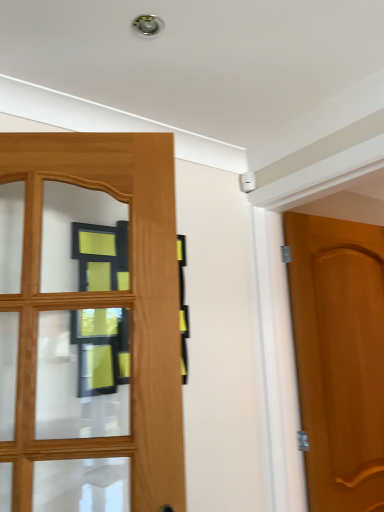
Measure the distance between wooden door at right and camera.

A distance of 5.68 feet exists between wooden door at right and camera.

This screenshot has height=512, width=384. Describe the element at coordinates (339, 357) in the screenshot. I see `wooden door at right` at that location.

Where is `wooden door at right`? The height and width of the screenshot is (512, 384). wooden door at right is located at coordinates (339, 357).

This screenshot has height=512, width=384. Identify the location of wooden door at right. (339, 357).